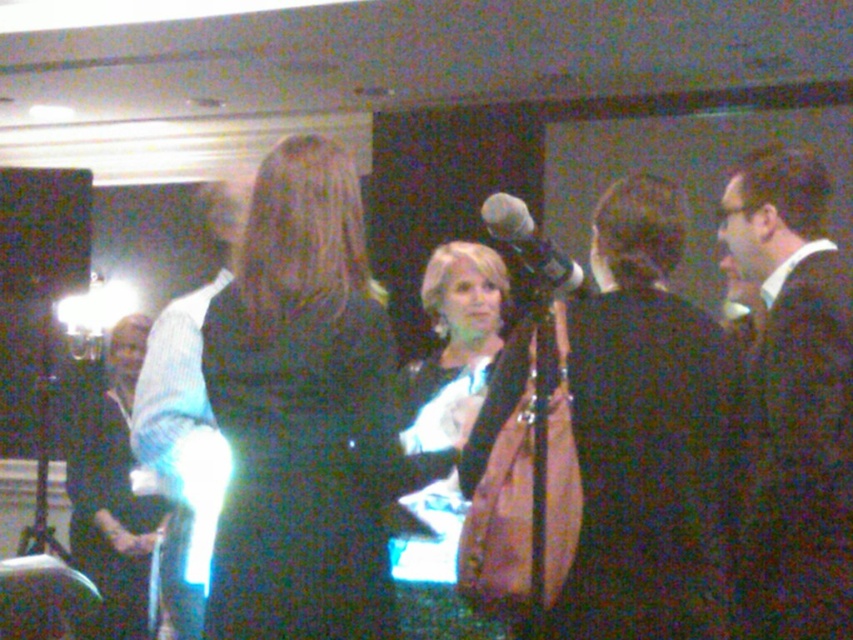
Question: Is black fabric suit at center above matte black dress at center?

Choices:
 (A) no
 (B) yes

Answer: (B)

Question: Is black suit at right above matte black dress at center?

Choices:
 (A) no
 (B) yes

Answer: (B)

Question: Which object appears closest to the camera in this image?

Choices:
 (A) matte black dress at center
 (B) shiny black dress at center

Answer: (B)

Question: Does black fabric suit at center have a greater width compared to matte black dress at center?

Choices:
 (A) no
 (B) yes

Answer: (A)

Question: Which object is farther from the camera taking this photo?

Choices:
 (A) matte black dress at center
 (B) black fabric suit at center
 (C) black suit at right

Answer: (A)

Question: Which of these objects is positioned closest to the black fabric dress at center?

Choices:
 (A) black suit at right
 (B) black fabric suit at center

Answer: (B)